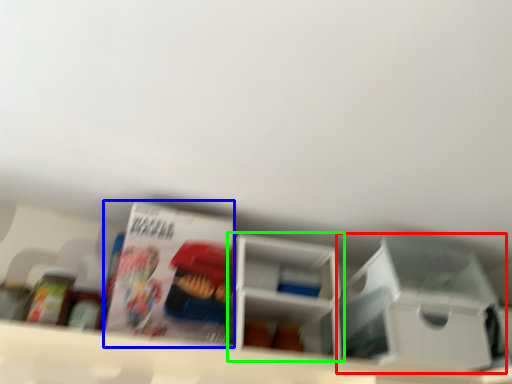
Question: Which object is positioned closest to storage box (highlighted by a red box)? Select from magazine (highlighted by a blue box) and shelf (highlighted by a green box).

Choices:
 (A) magazine
 (B) shelf

Answer: (B)